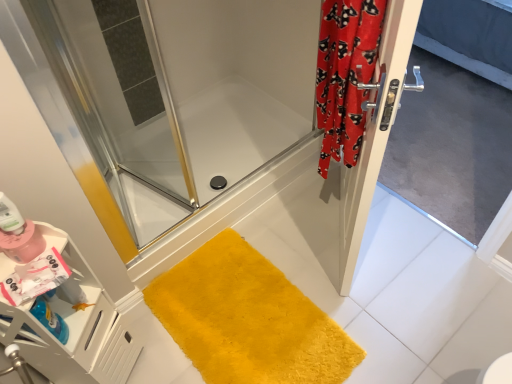
Where is `matte pink bottle at lower left`? The image size is (512, 384). matte pink bottle at lower left is located at coordinates (18, 234).

What do you see at coordinates (18, 234) in the screenshot?
I see `matte pink bottle at lower left` at bounding box center [18, 234].

The width and height of the screenshot is (512, 384). What do you see at coordinates (248, 319) in the screenshot?
I see `yellow plush bath mat at lower center` at bounding box center [248, 319].

The height and width of the screenshot is (384, 512). What do you see at coordinates (178, 112) in the screenshot?
I see `clear glass shower door at center` at bounding box center [178, 112].

Describe the element at coordinates (375, 131) in the screenshot. I see `satin silver door at right` at that location.

Where is `red velvet curtain at right`? This screenshot has width=512, height=384. red velvet curtain at right is located at coordinates (345, 75).

Considering the relative positions of silver metallic screen door at right and yellow plush bath mat at lower center in the image provided, is silver metallic screen door at right to the left of yellow plush bath mat at lower center from the viewer's perspective?

Incorrect, silver metallic screen door at right is not on the left side of yellow plush bath mat at lower center.

From a real-world perspective, is silver metallic screen door at right physically located above or below yellow plush bath mat at lower center?

From a real-world perspective, silver metallic screen door at right is physically above yellow plush bath mat at lower center.

Which object is closer to the camera taking this photo, silver metallic screen door at right or yellow plush bath mat at lower center?

Positioned in front is silver metallic screen door at right.

From the image's perspective, would you say yellow plush bath mat at lower center is shown under matte pink bottle at lower left?

Indeed, from the image's perspective, yellow plush bath mat at lower center is shown beneath matte pink bottle at lower left.

Is yellow plush bath mat at lower center closer to the viewer compared to matte pink bottle at lower left?

That is False.

From the picture: Is yellow plush bath mat at lower center outside of matte pink bottle at lower left?

yellow plush bath mat at lower center lies outside matte pink bottle at lower left's area.

Can you confirm if yellow plush bath mat at lower center is taller than matte pink bottle at lower left?

No, yellow plush bath mat at lower center is not taller than matte pink bottle at lower left.

Is silver metallic screen door at right directly adjacent to matte pink bottle at lower left?

They are not placed beside each other.

From the image's perspective, which one is positioned lower, silver metallic screen door at right or matte pink bottle at lower left?

matte pink bottle at lower left appears lower in the image.

From a real-world perspective, is silver metallic screen door at right on matte pink bottle at lower left?

No, from a real-world perspective, silver metallic screen door at right is not above matte pink bottle at lower left.

Is silver metallic screen door at right oriented towards matte pink bottle at lower left?

Yes, silver metallic screen door at right is aimed at matte pink bottle at lower left.

From the picture: Which object is closer to the camera taking this photo, clear glass shower door at center or red velvet curtain at right?

red velvet curtain at right is closer to the camera.

Can you tell me how much clear glass shower door at center and red velvet curtain at right differ in facing direction?

The angular difference between clear glass shower door at center and red velvet curtain at right is 142 degrees.

In the scene shown: Which point is more distant from viewer, (164, 245) or (338, 157)?

Point (164, 245)

Looking at this image, is clear glass shower door at center not close to red velvet curtain at right?

Actually, clear glass shower door at center and red velvet curtain at right are a little close together.

From a real-world perspective, is silver metallic screen door at right physically located above or below clear glass shower door at center?

silver metallic screen door at right is situated higher than clear glass shower door at center in the real world.

Between silver metallic screen door at right and clear glass shower door at center, which one has larger width?

Wider between the two is clear glass shower door at center.

Consider the image. How different are the orientations of silver metallic screen door at right and clear glass shower door at center in degrees?

The angle between the facing direction of silver metallic screen door at right and the facing direction of clear glass shower door at center is 90.4 degrees.

Would you say silver metallic screen door at right is a long distance from clear glass shower door at center?

Actually, silver metallic screen door at right and clear glass shower door at center are a little close together.

Is clear glass shower door at center not inside matte pink bottle at lower left?

Indeed, clear glass shower door at center is completely outside matte pink bottle at lower left.

From a real-world perspective, between clear glass shower door at center and matte pink bottle at lower left, who is vertically lower?

clear glass shower door at center, from a real-world perspective.

Who is smaller, clear glass shower door at center or matte pink bottle at lower left?

With smaller size is matte pink bottle at lower left.

Which is in front, point (0, 246) or point (430, 100)?

The point (0, 246) is closer.

Can you confirm if matte pink bottle at lower left is thinner than silver metallic screen door at right?

Correct, the width of matte pink bottle at lower left is less than that of silver metallic screen door at right.

You are a GUI agent. You are given a task and a screenshot of the screen. Output one action in this format:
    pyautogui.click(x=<x>, y=<y>)
    Task: Click on the screen door below the matte pink bottle at lower left (from a real-world perspective)
    This screenshot has height=384, width=512.
    Given the screenshot: What is the action you would take?
    pyautogui.click(x=452, y=145)

Would you consider matte pink bottle at lower left to be distant from silver metallic screen door at right?

Yes, matte pink bottle at lower left is far from silver metallic screen door at right.

I want to click on bath mat below the silver metallic screen door at right (from a real-world perspective), so click(x=248, y=319).

At what (x,y) coordinates should I click in order to perform the action: click on cleaning product located above the yellow plush bath mat at lower center (from the image's perspective). Please return your answer as a coordinate pair (x, y). Image resolution: width=512 pixels, height=384 pixels. Looking at the image, I should click on (18, 234).

Based on the photo, when comparing their distances from clear glass shower door at center, does satin silver door at right or red velvet curtain at right seem further?

The object further to clear glass shower door at center is satin silver door at right.

Considering their positions, is yellow plush bath mat at lower center positioned closer to clear glass shower door at center than red velvet curtain at right?

red velvet curtain at right.

Which object lies nearer to the anchor point matte pink bottle at lower left, satin silver door at right or clear glass shower door at center?

Based on the image, satin silver door at right appears to be nearer to matte pink bottle at lower left.

Looking at this image, which object lies nearer to the anchor point matte pink bottle at lower left, clear glass shower door at center or red velvet curtain at right?

red velvet curtain at right.

Which object lies further to the anchor point silver metallic screen door at right, matte pink bottle at lower left or yellow plush bath mat at lower center?

Based on the image, matte pink bottle at lower left appears to be further to silver metallic screen door at right.

Which object lies nearer to the anchor point silver metallic screen door at right, matte pink bottle at lower left or satin silver door at right?

satin silver door at right is positioned closer to the anchor silver metallic screen door at right.

When comparing their distances from red velvet curtain at right, does yellow plush bath mat at lower center or silver metallic screen door at right seem further?

Among the two, silver metallic screen door at right is located further to red velvet curtain at right.

In the scene shown: Based on their spatial positions, is satin silver door at right or silver metallic screen door at right further from matte pink bottle at lower left?

Based on the image, silver metallic screen door at right appears to be further to matte pink bottle at lower left.

Image resolution: width=512 pixels, height=384 pixels. I want to click on door situated between red velvet curtain at right and silver metallic screen door at right from left to right, so click(375, 131).

Identify the location of shower door located between matte pink bottle at lower left and red velvet curtain at right in the left-right direction. (178, 112).

You are a GUI agent. You are given a task and a screenshot of the screen. Output one action in this format:
    pyautogui.click(x=<x>, y=<y>)
    Task: Click on the shower door that lies between red velvet curtain at right and yellow plush bath mat at lower center from top to bottom
    The height and width of the screenshot is (384, 512).
    Given the screenshot: What is the action you would take?
    pyautogui.click(x=178, y=112)

This screenshot has width=512, height=384. What are the coordinates of `door situated between matte pink bottle at lower left and silver metallic screen door at right from left to right` in the screenshot? It's located at (375, 131).